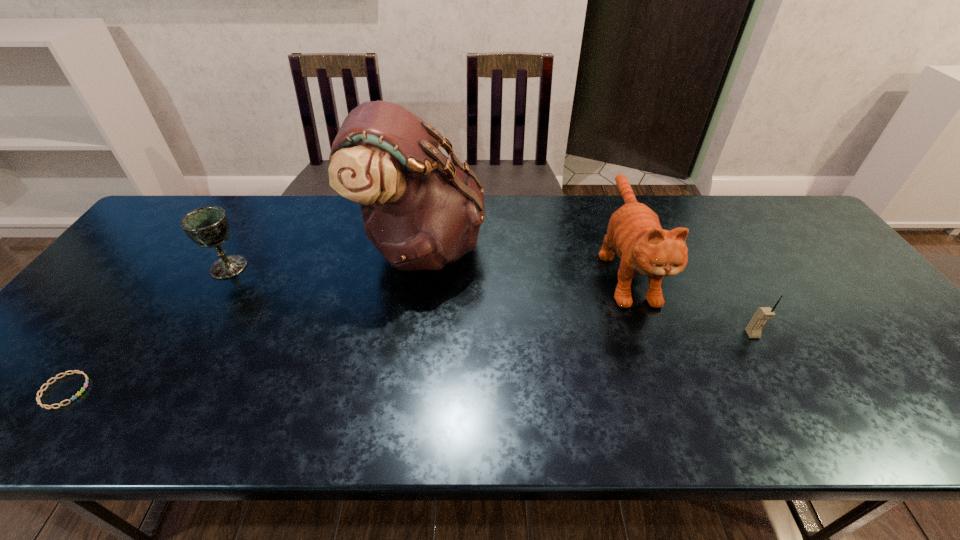
At what (x,y) coordinates should I click in order to perform the action: click on vacant space that is in between the cellular telephone and the cat. Please return your answer as a coordinate pair (x, y). This screenshot has width=960, height=540. Looking at the image, I should click on (689, 301).

You are a GUI agent. You are given a task and a screenshot of the screen. Output one action in this format:
    pyautogui.click(x=<x>, y=<y>)
    Task: Click on the unoccupied position between the chalice and the rightmost object
    This screenshot has height=540, width=960.
    Given the screenshot: What is the action you would take?
    (x=491, y=301)

At what (x,y) coordinates should I click in order to perform the action: click on empty location between the nearest object and the cat. Please return your answer as a coordinate pair (x, y). Looking at the image, I should click on (346, 329).

Identify the location of free space between the bracelet and the third object from left to right. This screenshot has width=960, height=540. (244, 318).

Find the location of `the fourth closest object to the fourth farthest object`. the fourth closest object to the fourth farthest object is located at coordinates (78, 372).

Identify the location of object that stands as the fourth closest to the third object from right to left. This screenshot has height=540, width=960. click(x=754, y=328).

Find the location of a particular element. free space in the image that satisfies the following two spatial constraints: 1. on the face of the cat; 2. on the surface of the shortest object showing star-shaped elements is located at coordinates (669, 390).